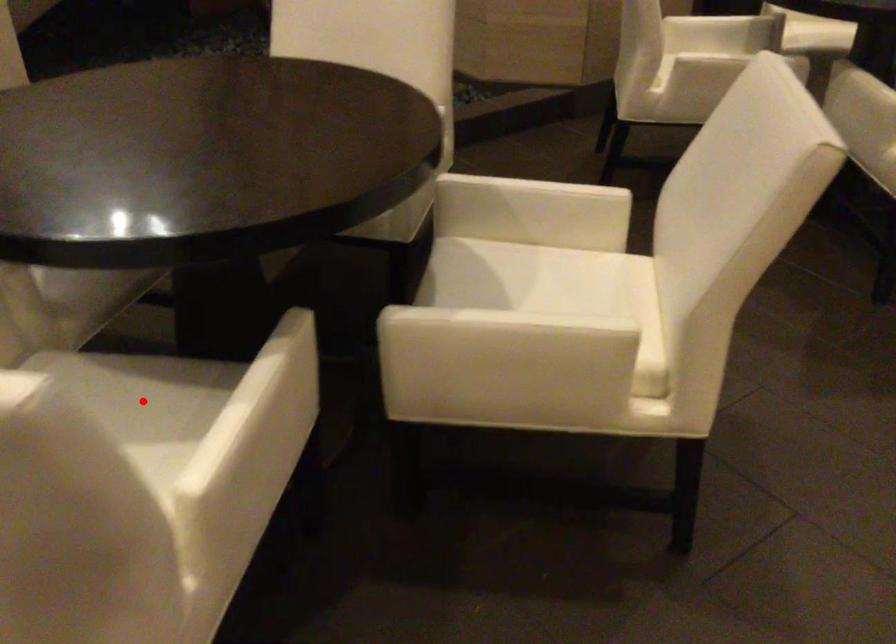
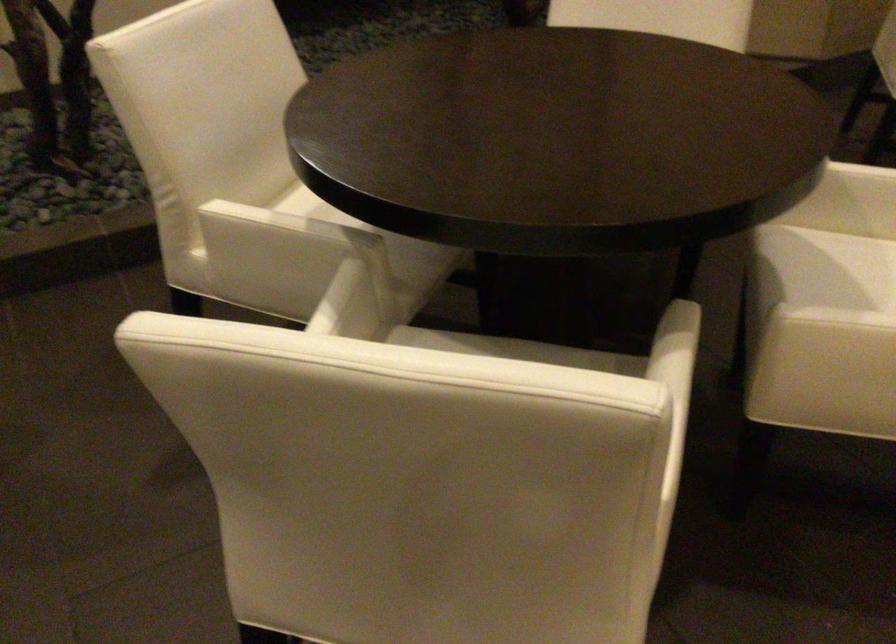
Question: I am providing you with two images of the same scene from different viewpoints. A red point is marked on the first image. Can you still see the location of the red point in image 2?

Choices:
 (A) Yes
 (B) No

Answer: (B)